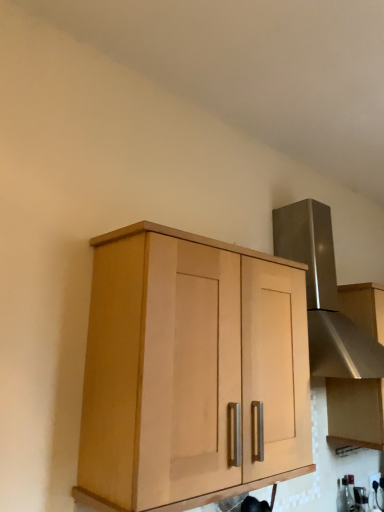
Image resolution: width=384 pixels, height=512 pixels. Describe the element at coordinates (344, 496) in the screenshot. I see `clear glass bottle at lower right` at that location.

Image resolution: width=384 pixels, height=512 pixels. In order to click on satin silver vent at upper right in this screenshot , I will do `click(324, 294)`.

Describe the element at coordinates (324, 294) in the screenshot. I see `satin silver vent at upper right` at that location.

The height and width of the screenshot is (512, 384). Identify the location of light wood cabinet at center, marked as the first cabinetry in a left-to-right arrangement. (189, 370).

Where is `white glossy electric outlet at lower right`? This screenshot has height=512, width=384. white glossy electric outlet at lower right is located at coordinates (373, 479).

The image size is (384, 512). Identify the location of satin silver hood at upper right, which is the 1th cabinetry in right-to-left order. (355, 412).

From a real-world perspective, between light wood cabinet at center, placed as the second cabinetry when sorted from right to left, and satin silver hood at upper right, placed as the second cabinetry when sorted from left to right, who is vertically higher?

satin silver hood at upper right, placed as the second cabinetry when sorted from left to right, from a real-world perspective.

Is point (195, 372) positioned behind point (374, 333)?

No, it is not.

Is light wood cabinet at center, marked as the first cabinetry in a left-to-right arrangement, positioned far away from satin silver hood at upper right, acting as the 1th cabinetry starting from the back?

Absolutely, light wood cabinet at center, marked as the first cabinetry in a left-to-right arrangement, is distant from satin silver hood at upper right, acting as the 1th cabinetry starting from the back.

Between light wood cabinet at center, the first cabinetry from the front, and satin silver hood at upper right, acting as the 1th cabinetry starting from the back, which one has more height?

satin silver hood at upper right, acting as the 1th cabinetry starting from the back, is taller.

Which object is wider, clear glass bottle at lower right or white glossy electric outlet at lower right?

Wider between the two is clear glass bottle at lower right.

Is clear glass bottle at lower right far away from white glossy electric outlet at lower right?

That's not correct — clear glass bottle at lower right is a little close to white glossy electric outlet at lower right.

Is clear glass bottle at lower right in front of or behind white glossy electric outlet at lower right in the image?

Clearly, clear glass bottle at lower right is in front of white glossy electric outlet at lower right.

From the image's perspective, is clear glass bottle at lower right above or below white glossy electric outlet at lower right?

Based on their image positions, clear glass bottle at lower right is located above white glossy electric outlet at lower right.

Is point (361, 286) closer to camera compared to point (352, 505)?

No, (361, 286) is further to viewer.

The width and height of the screenshot is (384, 512). I want to click on the 1st cabinetry above the clear glass bottle at lower right (from the image's perspective), so click(x=355, y=412).

Does satin silver hood at upper right, which is the 1th cabinetry in right-to-left order, have a smaller size compared to clear glass bottle at lower right?

No.

Does satin silver hood at upper right, arranged as the second cabinetry when viewed from the front, have a greater width compared to clear glass bottle at lower right?

Indeed, satin silver hood at upper right, arranged as the second cabinetry when viewed from the front, has a greater width compared to clear glass bottle at lower right.

Does satin silver hood at upper right, arranged as the second cabinetry when viewed from the front, have a smaller size compared to satin silver vent at upper right?

Yes.

Identify the location of cabinetry located behind the satin silver vent at upper right. (355, 412).

Does satin silver hood at upper right, which is the 1th cabinetry in right-to-left order, touch satin silver vent at upper right?

No, satin silver hood at upper right, which is the 1th cabinetry in right-to-left order, is not beside satin silver vent at upper right.

Is satin silver hood at upper right, arranged as the second cabinetry when viewed from the front, at the right side of white glossy electric outlet at lower right?

Indeed, satin silver hood at upper right, arranged as the second cabinetry when viewed from the front, is positioned on the right side of white glossy electric outlet at lower right.

Does satin silver hood at upper right, arranged as the second cabinetry when viewed from the front, have a smaller size compared to white glossy electric outlet at lower right?

No, satin silver hood at upper right, arranged as the second cabinetry when viewed from the front, is not smaller than white glossy electric outlet at lower right.

From the white glossy electric outlet at lower right, count 1st cabinetrys forward and point to it. Please provide its 2D coordinates.

[(355, 412)]

Image resolution: width=384 pixels, height=512 pixels. In order to click on bottle located underneath the light wood cabinet at center, marked as the first cabinetry in a left-to-right arrangement (from a real-world perspective) in this screenshot , I will do `click(344, 496)`.

Considering the relative sizes of light wood cabinet at center, placed as the second cabinetry when sorted from right to left, and clear glass bottle at lower right in the image provided, is light wood cabinet at center, placed as the second cabinetry when sorted from right to left, taller than clear glass bottle at lower right?

Correct, light wood cabinet at center, placed as the second cabinetry when sorted from right to left, is much taller as clear glass bottle at lower right.

Is light wood cabinet at center, which is counted as the 2th cabinetry, starting from the back, not within clear glass bottle at lower right?

light wood cabinet at center, which is counted as the 2th cabinetry, starting from the back, is positioned outside clear glass bottle at lower right.

Considering the positions of objects white glossy electric outlet at lower right and clear glass bottle at lower right in the image provided, who is more to the left, white glossy electric outlet at lower right or clear glass bottle at lower right?

From the viewer's perspective, clear glass bottle at lower right appears more on the left side.

Is white glossy electric outlet at lower right inside or outside of clear glass bottle at lower right?

white glossy electric outlet at lower right is spatially situated outside clear glass bottle at lower right.

Considering the sizes of objects white glossy electric outlet at lower right and clear glass bottle at lower right in the image provided, who is shorter, white glossy electric outlet at lower right or clear glass bottle at lower right?

white glossy electric outlet at lower right.

This screenshot has height=512, width=384. Identify the location of cabinetry above the light wood cabinet at center, marked as the first cabinetry in a left-to-right arrangement (from a real-world perspective). (355, 412).

Where is `electric outlet below the clear glass bottle at lower right (from the image's perspective)`? electric outlet below the clear glass bottle at lower right (from the image's perspective) is located at coordinates (373, 479).

From the picture: Looking at the image, which one is located further to satin silver hood at upper right, arranged as the second cabinetry when viewed from the front, clear glass bottle at lower right or satin silver vent at upper right?

satin silver vent at upper right lies further to satin silver hood at upper right, arranged as the second cabinetry when viewed from the front, than the other object.

From the image, which object appears to be nearer to satin silver vent at upper right, light wood cabinet at center, placed as the second cabinetry when sorted from right to left, or white glossy electric outlet at lower right?

light wood cabinet at center, placed as the second cabinetry when sorted from right to left, is positioned closer to the anchor satin silver vent at upper right.

Considering their positions, is clear glass bottle at lower right positioned closer to satin silver vent at upper right than white glossy electric outlet at lower right?

clear glass bottle at lower right is closer to satin silver vent at upper right.

Estimate the real-world distances between objects in this image. Which object is closer to satin silver hood at upper right, acting as the 1th cabinetry starting from the back, satin silver vent at upper right or clear glass bottle at lower right?

clear glass bottle at lower right is positioned closer to the anchor satin silver hood at upper right, acting as the 1th cabinetry starting from the back.

Looking at the image, which one is located closer to clear glass bottle at lower right, light wood cabinet at center, the first cabinetry from the front, or satin silver vent at upper right?

Among the two, satin silver vent at upper right is located nearer to clear glass bottle at lower right.

Which object lies nearer to the anchor point light wood cabinet at center, the first cabinetry from the front, clear glass bottle at lower right or satin silver hood at upper right, acting as the 1th cabinetry starting from the back?

Among the two, satin silver hood at upper right, acting as the 1th cabinetry starting from the back, is located nearer to light wood cabinet at center, the first cabinetry from the front.

From the picture: Looking at the image, which one is located closer to satin silver hood at upper right, placed as the second cabinetry when sorted from left to right, light wood cabinet at center, marked as the first cabinetry in a left-to-right arrangement, or satin silver vent at upper right?

Based on the image, satin silver vent at upper right appears to be nearer to satin silver hood at upper right, placed as the second cabinetry when sorted from left to right.

Considering their positions, is light wood cabinet at center, marked as the first cabinetry in a left-to-right arrangement, positioned closer to satin silver vent at upper right than clear glass bottle at lower right?

light wood cabinet at center, marked as the first cabinetry in a left-to-right arrangement, lies closer to satin silver vent at upper right than the other object.

Identify the location of cabinetry between light wood cabinet at center, the first cabinetry from the front, and white glossy electric outlet at lower right in the front-back direction. The image size is (384, 512). (355, 412).

Locate an element on the screen. bottle between satin silver hood at upper right, acting as the 1th cabinetry starting from the back, and white glossy electric outlet at lower right, in the vertical direction is located at coordinates (344, 496).

The height and width of the screenshot is (512, 384). Identify the location of vent between light wood cabinet at center, marked as the first cabinetry in a left-to-right arrangement, and satin silver hood at upper right, placed as the second cabinetry when sorted from left to right, from left to right. (324, 294).

This screenshot has width=384, height=512. Find the location of `cabinetry positioned between light wood cabinet at center, placed as the second cabinetry when sorted from right to left, and clear glass bottle at lower right from near to far`. cabinetry positioned between light wood cabinet at center, placed as the second cabinetry when sorted from right to left, and clear glass bottle at lower right from near to far is located at coordinates (355, 412).